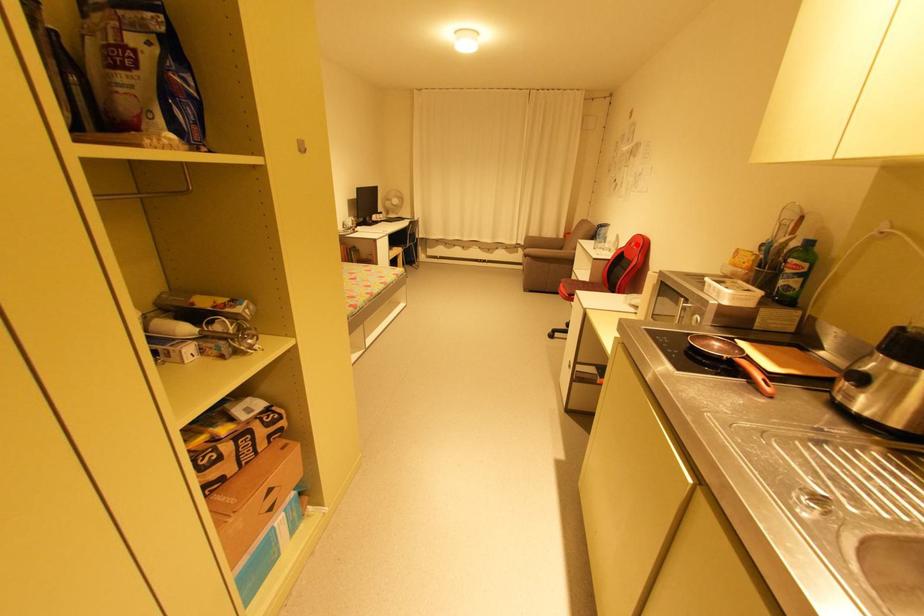
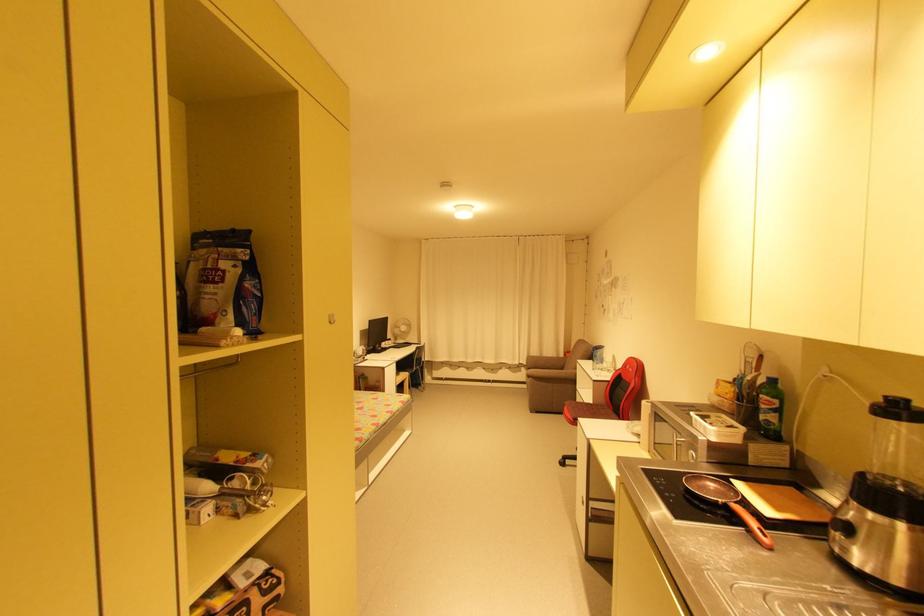
Find the pixel in the second image that matches the highlighted location in the first image.

(631, 367)